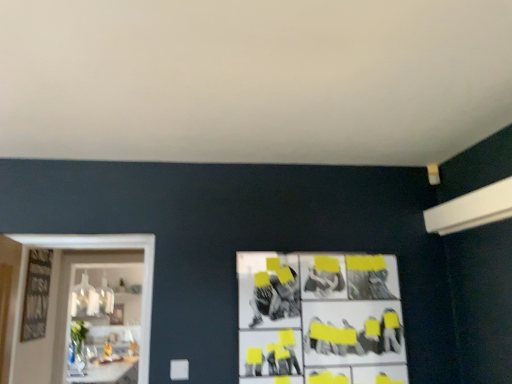
Question: Is white glossy shelf at left bigger than black and white collage at center?

Choices:
 (A) yes
 (B) no

Answer: (A)

Question: Is black and white collage at center located within white glossy shelf at left?

Choices:
 (A) no
 (B) yes

Answer: (A)

Question: Does white glossy shelf at left have a lesser width compared to black and white collage at center?

Choices:
 (A) yes
 (B) no

Answer: (B)

Question: Can you confirm if white glossy shelf at left is positioned to the right of black and white collage at center?

Choices:
 (A) no
 (B) yes

Answer: (A)

Question: Is white glossy shelf at left next to black and white collage at center?

Choices:
 (A) yes
 (B) no

Answer: (B)

Question: From a real-world perspective, is black and white collage at center physically located above or below white glossy table at lower left?

Choices:
 (A) below
 (B) above

Answer: (B)

Question: Considering their positions, is black and white collage at center located in front of or behind white glossy table at lower left?

Choices:
 (A) front
 (B) behind

Answer: (A)

Question: Do you think black and white collage at center is within white glossy table at lower left, or outside of it?

Choices:
 (A) inside
 (B) outside

Answer: (B)

Question: Is black and white collage at center bigger or smaller than white glossy table at lower left?

Choices:
 (A) small
 (B) big

Answer: (A)

Question: Is white glossy table at lower left inside or outside of black and white collage at center?

Choices:
 (A) outside
 (B) inside

Answer: (A)

Question: Looking at the image, does white glossy table at lower left seem bigger or smaller compared to black and white collage at center?

Choices:
 (A) big
 (B) small

Answer: (A)

Question: Considering the relative positions of white glossy table at lower left and black and white collage at center in the image provided, is white glossy table at lower left to the left or to the right of black and white collage at center?

Choices:
 (A) right
 (B) left

Answer: (B)

Question: From their relative heights in the image, would you say white glossy table at lower left is taller or shorter than black and white collage at center?

Choices:
 (A) tall
 (B) short

Answer: (B)

Question: Is point (93, 279) closer or farther from the camera than point (272, 360)?

Choices:
 (A) closer
 (B) farther

Answer: (B)

Question: Visually, is white glossy shelf at left positioned to the left or to the right of black and white collage at center?

Choices:
 (A) right
 (B) left

Answer: (B)